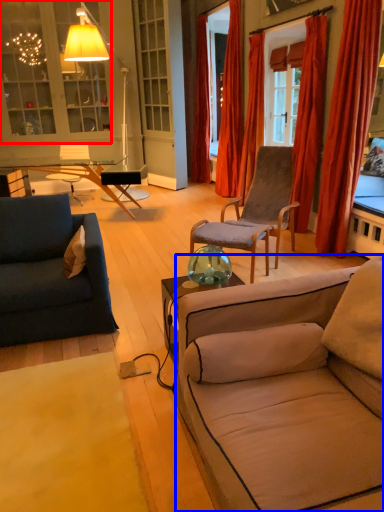
Question: Which object is further to the camera taking this photo, cabinetry (highlighted by a red box) or studio couch (highlighted by a blue box)?

Choices:
 (A) cabinetry
 (B) studio couch

Answer: (A)